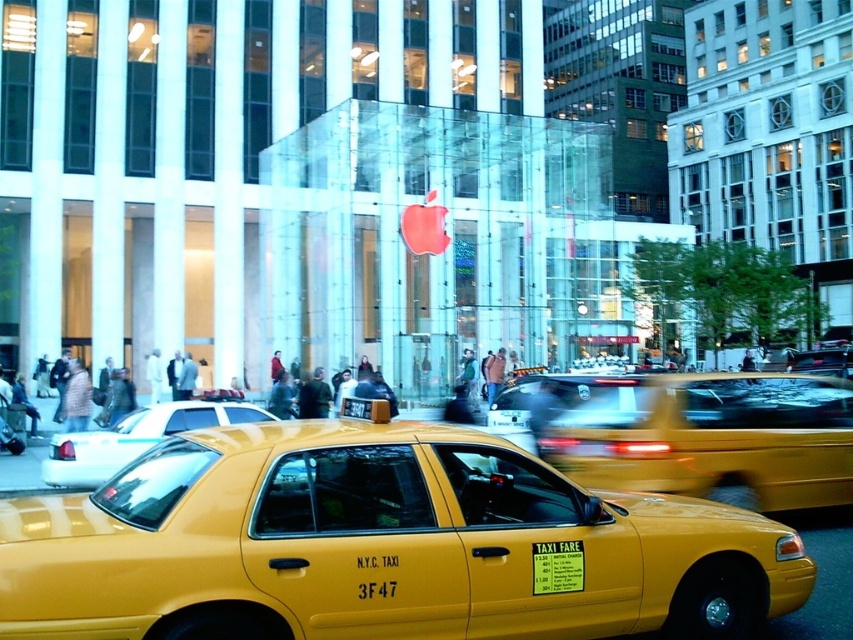
You are a pedestrian standing at the crosswalk. You see two taxis, the matte yellow taxi at center and the yellow matte taxi at center. Which one is positioned higher in the image?

The matte yellow taxi at center is positioned higher in the image than the yellow matte taxi at center.

You are a delivery driver who needs to park your truck between the two taxis in the scene. Can your truck fit between the matte yellow taxi at center and the yellow plastic taxi cab at center if your truck is 2 meters wide?

The matte yellow taxi at center is wider than the yellow plastic taxi cab at center. However, the exact distance between them isn not specified in the provided information. Without knowing the space between the two taxis, it is impossible to determine if the truck can fit.